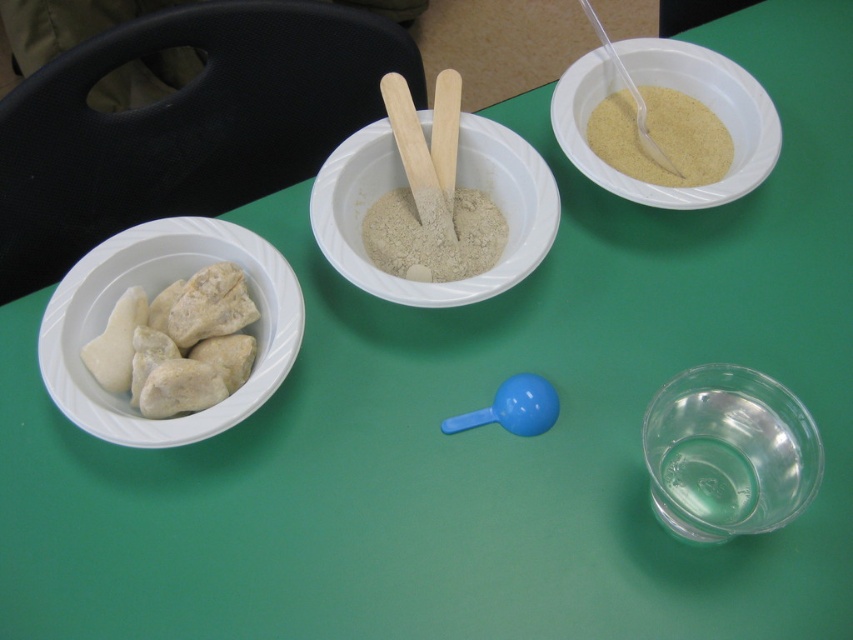
Consider the image. Can you confirm if matte plastic bowl at upper right is positioned below white stone rocks at left?

Incorrect, matte plastic bowl at upper right is not positioned below white stone rocks at left.

Is matte plastic bowl at upper right taller than white stone rocks at left?

Correct, matte plastic bowl at upper right is much taller as white stone rocks at left.

The height and width of the screenshot is (640, 853). What do you see at coordinates (680, 92) in the screenshot?
I see `matte plastic bowl at upper right` at bounding box center [680, 92].

The image size is (853, 640). I want to click on matte plastic bowl at upper right, so point(680,92).

Is yellowish powder at upper right below white powdery sand at center?

Actually, yellowish powder at upper right is above white powdery sand at center.

Can you confirm if yellowish powder at upper right is positioned to the left of white powdery sand at center?

No, yellowish powder at upper right is not to the left of white powdery sand at center.

Which is in front, point (616, 144) or point (375, 257)?

Point (375, 257)

Where is `yellowish powder at upper right`? yellowish powder at upper right is located at coordinates [660, 138].

Measure the distance between white stone rocks at left and white powdery sand at center.

white stone rocks at left and white powdery sand at center are 7.29 inches apart.

Does point (228, 378) come farther from viewer compared to point (437, 256)?

No, (228, 378) is closer to viewer.

Image resolution: width=853 pixels, height=640 pixels. In order to click on white stone rocks at left in this screenshot , I will do `click(177, 342)`.